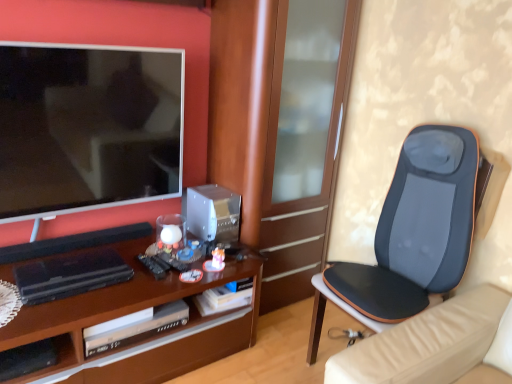
Question: Is brown wood desk at center in contact with black mesh cushion at right?

Choices:
 (A) no
 (B) yes

Answer: (A)

Question: Considering the relative positions of brown wood desk at center and black mesh cushion at right in the image provided, is brown wood desk at center to the right of black mesh cushion at right from the viewer's perspective?

Choices:
 (A) yes
 (B) no

Answer: (B)

Question: Could you tell me if brown wood desk at center is turned towards black mesh cushion at right?

Choices:
 (A) yes
 (B) no

Answer: (B)

Question: Considering the relative positions of brown wood desk at center and black mesh cushion at right in the image provided, is brown wood desk at center behind black mesh cushion at right?

Choices:
 (A) no
 (B) yes

Answer: (B)

Question: Considering the relative sizes of brown wood desk at center and black mesh cushion at right in the image provided, is brown wood desk at center thinner than black mesh cushion at right?

Choices:
 (A) no
 (B) yes

Answer: (A)

Question: Can you confirm if brown wood desk at center is positioned to the left of black mesh cushion at right?

Choices:
 (A) yes
 (B) no

Answer: (A)

Question: Can you confirm if black mesh cushion at right is thinner than brown wood desk at center?

Choices:
 (A) yes
 (B) no

Answer: (A)

Question: Does black mesh cushion at right have a smaller size compared to brown wood desk at center?

Choices:
 (A) yes
 (B) no

Answer: (A)

Question: Does black mesh cushion at right have a greater height compared to brown wood desk at center?

Choices:
 (A) yes
 (B) no

Answer: (A)

Question: Is black mesh cushion at right to the right of brown wood desk at center from the viewer's perspective?

Choices:
 (A) no
 (B) yes

Answer: (B)

Question: Considering the relative positions of black mesh cushion at right and brown wood desk at center in the image provided, is black mesh cushion at right to the left of brown wood desk at center from the viewer's perspective?

Choices:
 (A) yes
 (B) no

Answer: (B)

Question: Is black mesh cushion at right facing towards brown wood desk at center?

Choices:
 (A) yes
 (B) no

Answer: (B)

Question: Is brown wood cabinet at center outside of black mesh cushion at right?

Choices:
 (A) yes
 (B) no

Answer: (A)